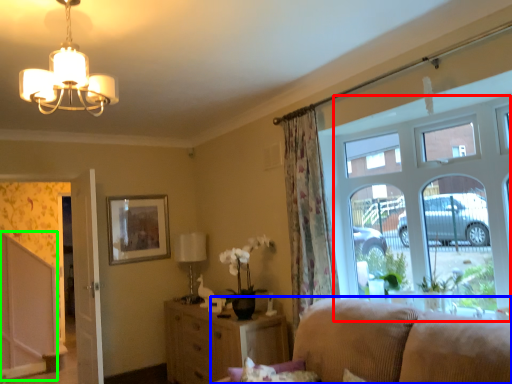
Question: Considering the real-world distances, which object is farthest from window (highlighted by a red box)? studio couch (highlighted by a blue box) or screen door (highlighted by a green box)?

Choices:
 (A) studio couch
 (B) screen door

Answer: (B)